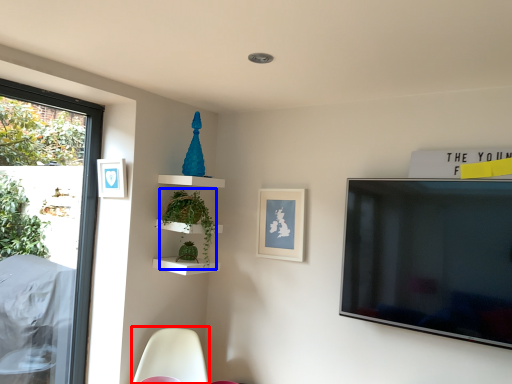
Question: Among these objects, which one is nearest to the camera, swivel chair (highlighted by a red box) or plant (highlighted by a blue box)?

Choices:
 (A) swivel chair
 (B) plant

Answer: (A)